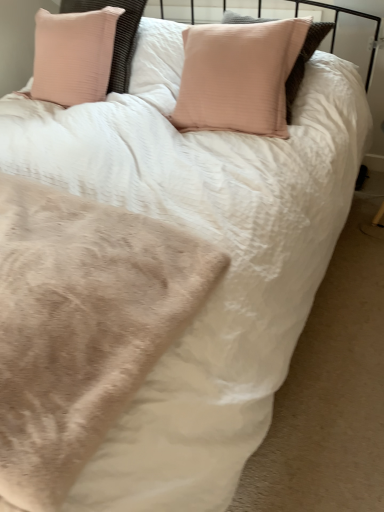
Question: Looking at their shapes, would you say beige plush blanket at lower left is wider or thinner than pink plush pillow at upper left?

Choices:
 (A) wide
 (B) thin

Answer: (A)

Question: From a real-world perspective, is beige plush blanket at lower left positioned above or below pink plush pillow at upper left?

Choices:
 (A) above
 (B) below

Answer: (B)

Question: Which is correct: beige plush blanket at lower left is inside pink plush pillow at upper left, or outside of it?

Choices:
 (A) outside
 (B) inside

Answer: (A)

Question: Is pink plush pillow at upper left inside the boundaries of beige plush blanket at lower left, or outside?

Choices:
 (A) inside
 (B) outside

Answer: (B)

Question: In terms of height, does pink plush pillow at upper left look taller or shorter compared to beige plush blanket at lower left?

Choices:
 (A) tall
 (B) short

Answer: (A)

Question: Considering the relative positions of pink plush pillow at upper left and beige plush blanket at lower left in the image provided, is pink plush pillow at upper left to the left or to the right of beige plush blanket at lower left?

Choices:
 (A) left
 (B) right

Answer: (A)

Question: From the image's perspective, is pink plush pillow at upper left positioned above or below beige plush blanket at lower left?

Choices:
 (A) above
 (B) below

Answer: (A)